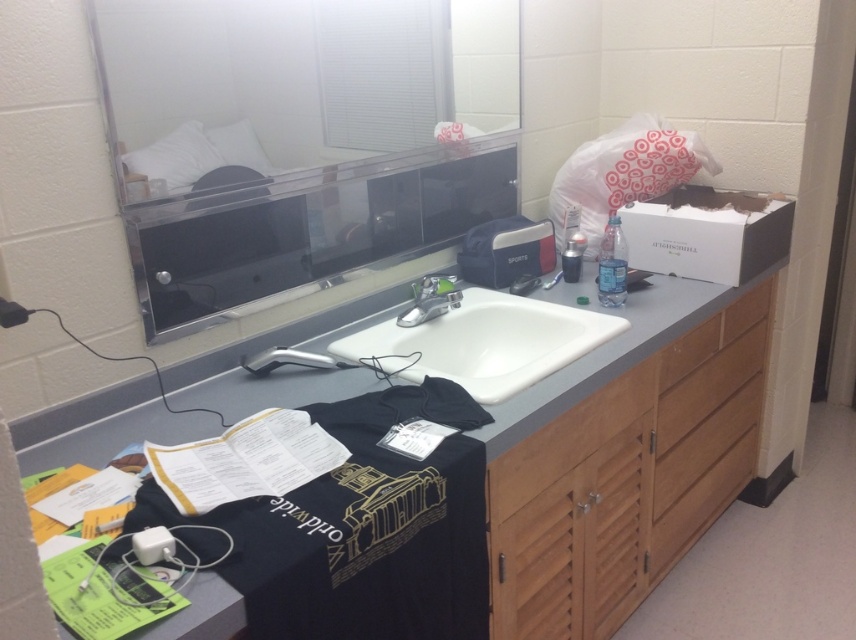
You are standing in front of the bathroom vanity and want to pick up the wooden at lower right and the silver metallic faucet at center. Which object will you need to reach further to grab?

You will need to reach further to grab the silver metallic faucet at center because it is farther from you than the wooden at lower right, which is closer.

You are organizing the bathroom and need to place a large decorative item. Which object, the black matte vanity at center or the wooden at lower right, would be more suitable for placing a large item on top?

The black matte vanity at center is bigger than the wooden at lower right, so it would be more suitable for placing a large decorative item on top.

You are organizing items on the black matte vanity at center and the wooden at lower right. Which surface has more vertical space available for stacking items?

The black matte vanity at center has a greater height compared to the wooden at lower right, so it has more vertical space available for stacking items.